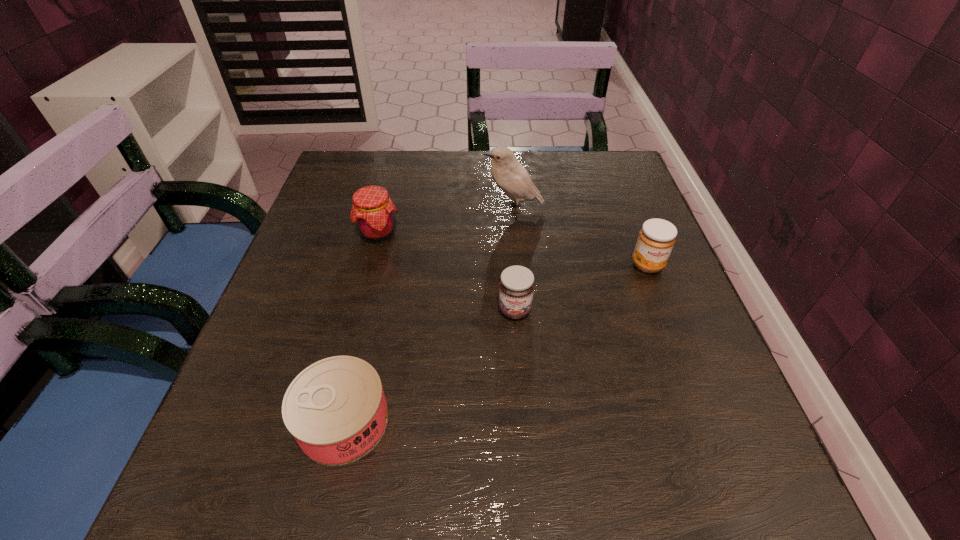
Select which object is the closest to the second jam from right to left. Please provide its 2D coordinates. Your answer should be formatted as a tuple, i.e. [(x, y)], where the tuple contains the x and y coordinates of a point satisfying the conditions above.

[(336, 410)]

Identify the location of jam that stands as the closest to the third nearest object. (516, 287).

The height and width of the screenshot is (540, 960). I want to click on the second closest jam relative to the farthest jam, so click(x=656, y=239).

Find the location of a particular element. The width and height of the screenshot is (960, 540). vacant point that satisfies the following two spatial constraints: 1. at the beak of the tallest object; 2. on the front label of the second nearest object is located at coordinates (522, 310).

This screenshot has height=540, width=960. Find the location of `free location that satisfies the following two spatial constraints: 1. at the beak of the tallest object; 2. on the front label of the fourth farthest object`. free location that satisfies the following two spatial constraints: 1. at the beak of the tallest object; 2. on the front label of the fourth farthest object is located at coordinates (522, 310).